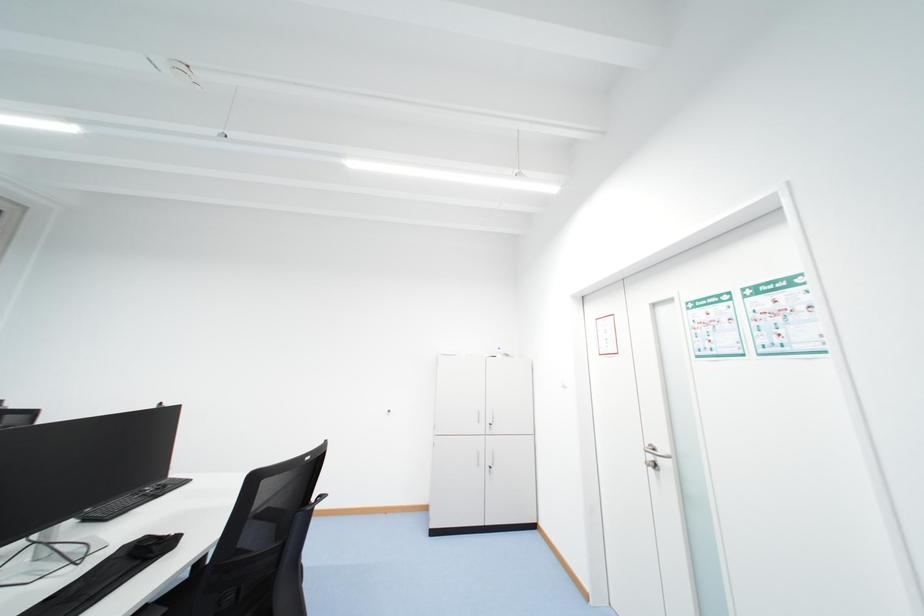
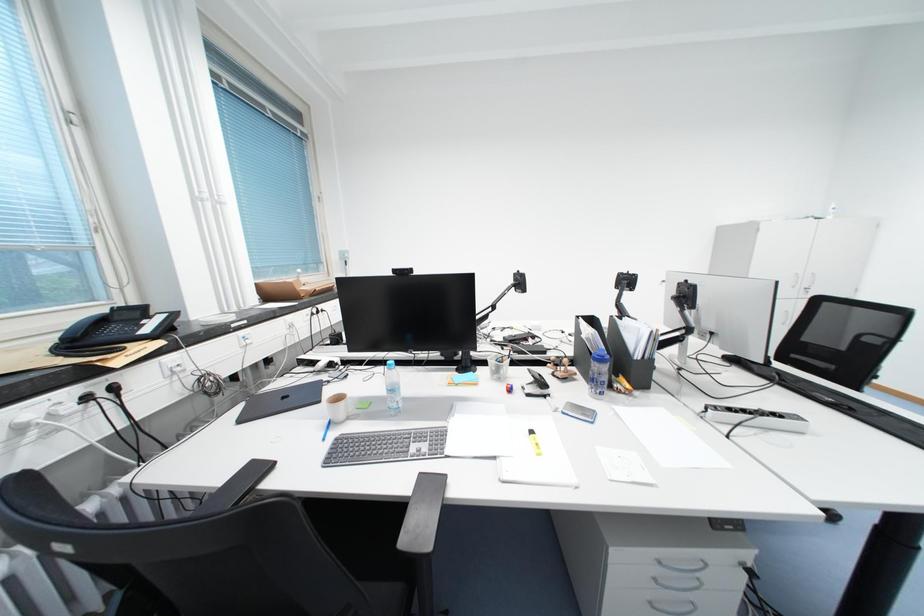
Question: Which direction would the cameraman need to move to produce the second image? Reply with the corresponding letter.

Choices:
 (A) Left
 (B) Right
 (C) Forward
 (D) Backward

Answer: (A)